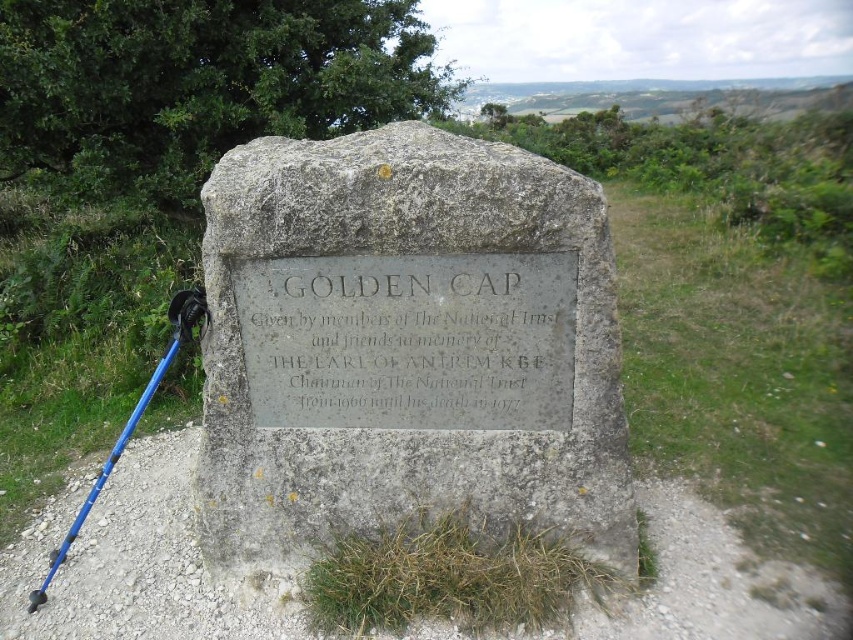
Question: Which is farther from the gray stone plaque at center?

Choices:
 (A) blue plastic ski pole at lower left
 (B) silver/grey stone plaque at center

Answer: (A)

Question: Observing the image, what is the correct spatial positioning of silver/grey stone plaque at center in reference to blue plastic ski pole at lower left?

Choices:
 (A) right
 (B) left

Answer: (A)

Question: Does gray stone plaque at center have a lesser width compared to silver/grey stone plaque at center?

Choices:
 (A) no
 (B) yes

Answer: (A)

Question: Which point is closer to the camera taking this photo?

Choices:
 (A) (405, 282)
 (B) (39, 595)

Answer: (A)

Question: Observing the image, what is the correct spatial positioning of gray stone plaque at center in reference to blue plastic ski pole at lower left?

Choices:
 (A) right
 (B) left

Answer: (A)

Question: Which point is closer to the camera taking this photo?

Choices:
 (A) (45, 577)
 (B) (486, 358)

Answer: (B)